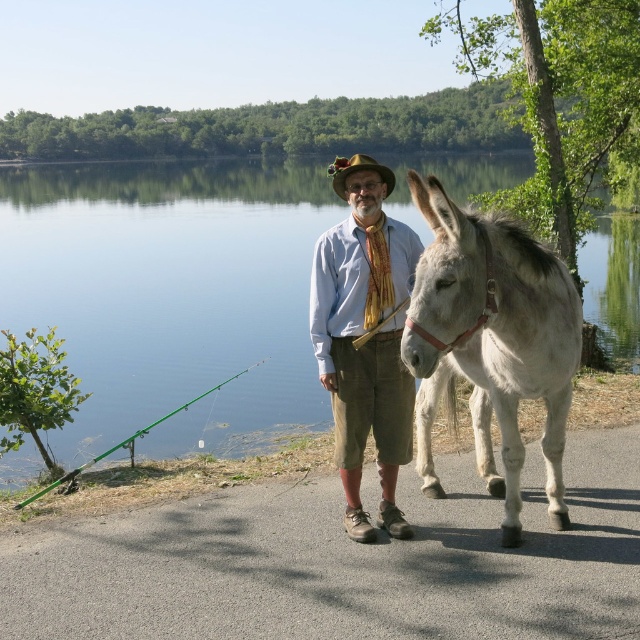
Question: Which object appears closest to the camera in this image?

Choices:
 (A) clear blue water at center
 (B) gray matte donkey at right
 (C) brown felt cowboy hat at center

Answer: (B)

Question: Which of the following is the closest to the observer?

Choices:
 (A) (508, 522)
 (B) (342, 193)

Answer: (B)

Question: Among these objects, which one is nearest to the camera?

Choices:
 (A) clear blue water at center
 (B) gray matte donkey at right
 (C) light blue corduroy shirt at center

Answer: (B)

Question: Is gray matte donkey at right below brown felt cowboy hat at center?

Choices:
 (A) no
 (B) yes

Answer: (B)

Question: Can you confirm if clear blue water at center is positioned to the right of light blue corduroy shirt at center?

Choices:
 (A) no
 (B) yes

Answer: (A)

Question: Is clear blue water at center wider than light blue corduroy shirt at center?

Choices:
 (A) no
 (B) yes

Answer: (B)